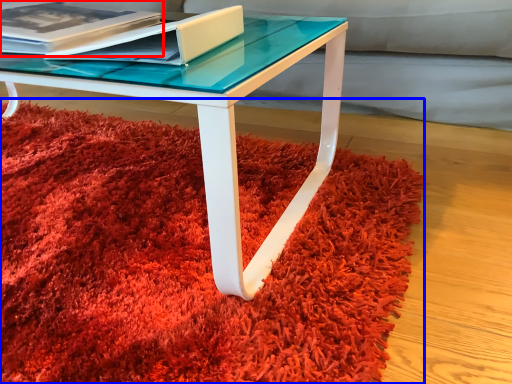
Question: Among these objects, which one is nearest to the camera, paperback book (highlighted by a red box) or mat (highlighted by a blue box)?

Choices:
 (A) paperback book
 (B) mat

Answer: (B)